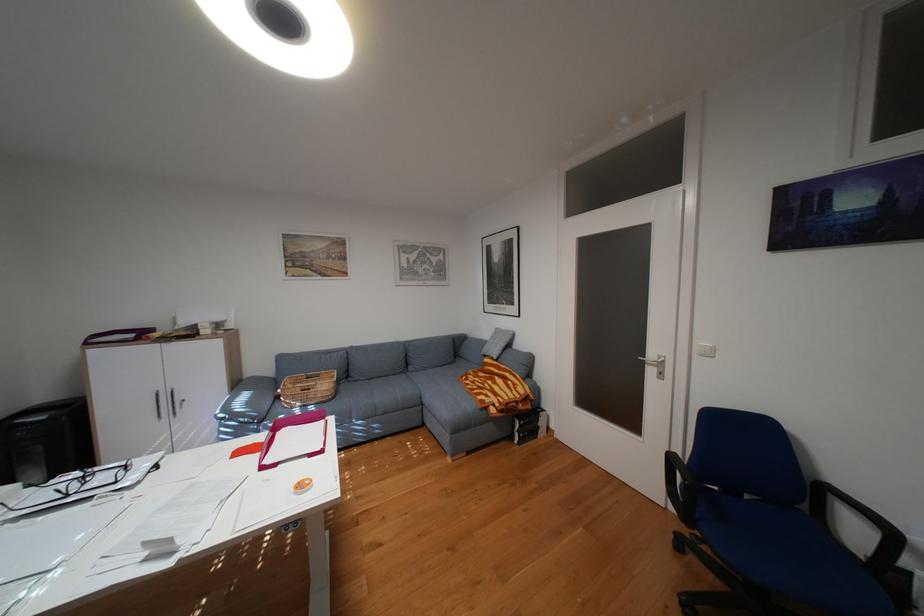
Image resolution: width=924 pixels, height=616 pixels. What do you see at coordinates (416, 387) in the screenshot?
I see `the blue sofa surface` at bounding box center [416, 387].